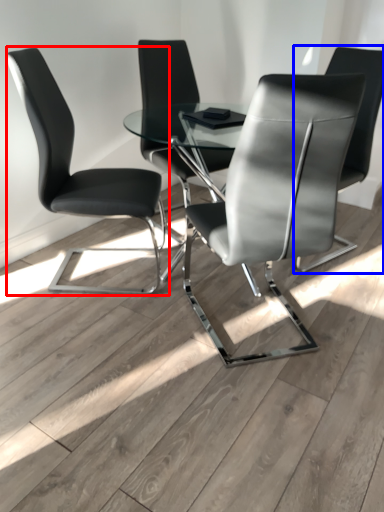
Question: Which object is closer to the camera taking this photo, chair (highlighted by a red box) or chair (highlighted by a blue box)?

Choices:
 (A) chair
 (B) chair

Answer: (A)